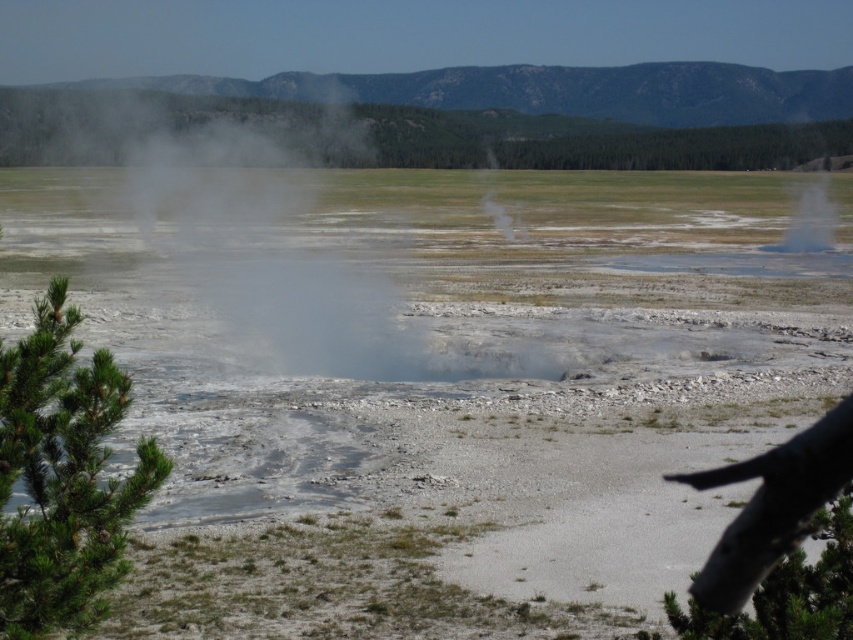
You are a park ranger guiding visitors through this geothermal area. You notice a green rough bark branch at lower right and white vapor at center. Which object is positioned more to the east if the image is oriented with north at the top?

The green rough bark branch at lower right is positioned more to the east than the white vapor at center because it is to the right of the white vapor at center, and the image is oriented with north at the top, meaning east is to the right.

You are a hiker standing at the point with coordinates point (488, 188) and want to reach the point with coordinates point (91, 380). Which direction should you move to get closer to your destination?

To reach point (91, 380) from point (488, 188), you should move forward since point (91, 380) is in front of point (488, 188).

You are a hiker who just arrived at the geothermal area. You notice a green rough bark branch at lower right. Where is it located in terms of coordinates?

The green rough bark branch at lower right is located at point (779, 544).